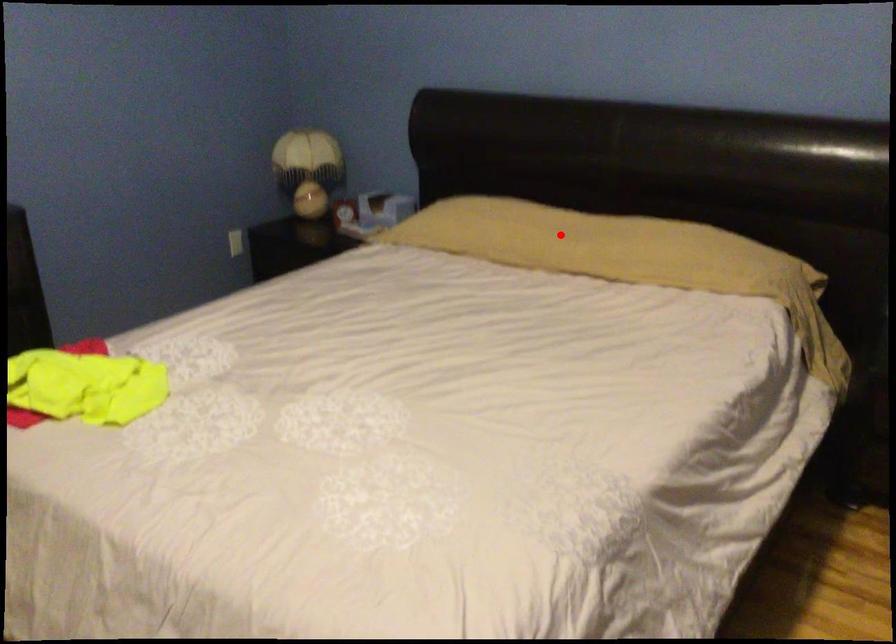
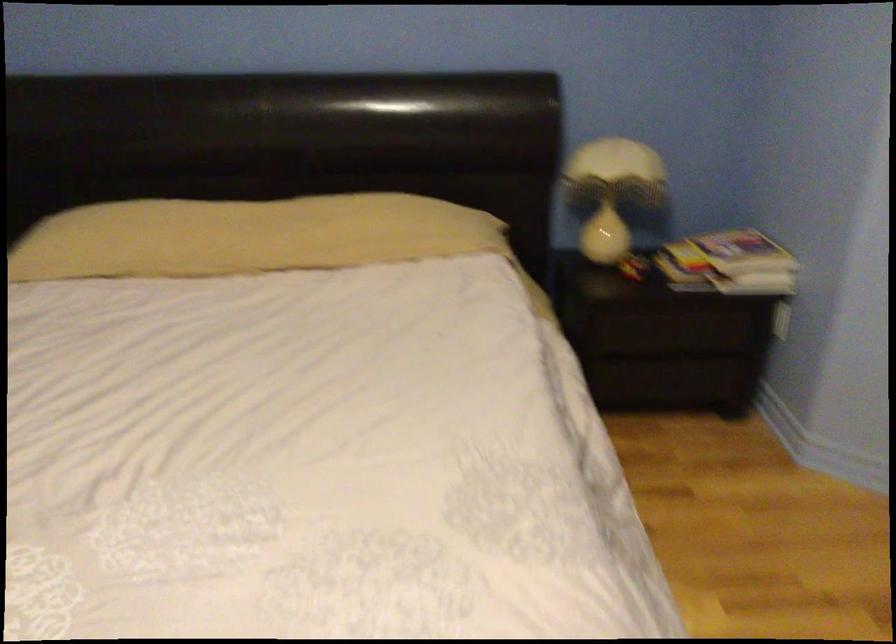
Locate, in the second image, the point that corresponds to the highlighted location in the first image.

(247, 236)